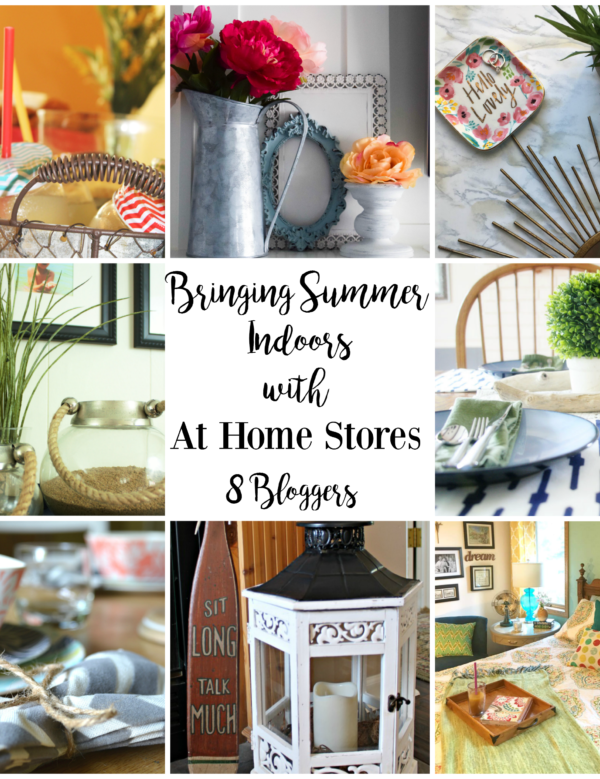
This screenshot has height=779, width=600. Find the location of `green plants`. green plants is located at coordinates (8, 406), (577, 319), (591, 29).